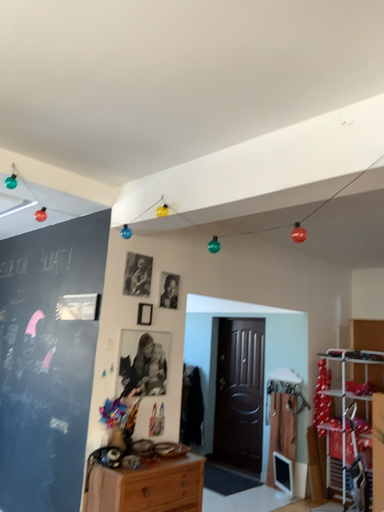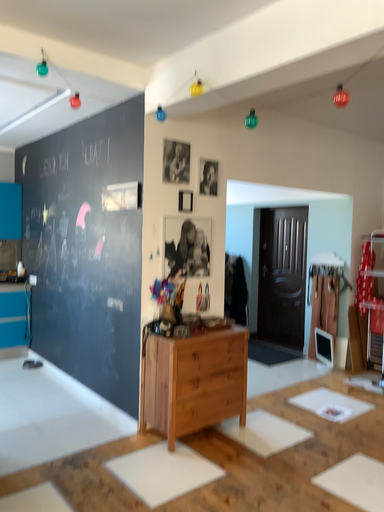
Question: How did the camera likely rotate when shooting the video?

Choices:
 (A) rotated downward
 (B) rotated upward

Answer: (A)